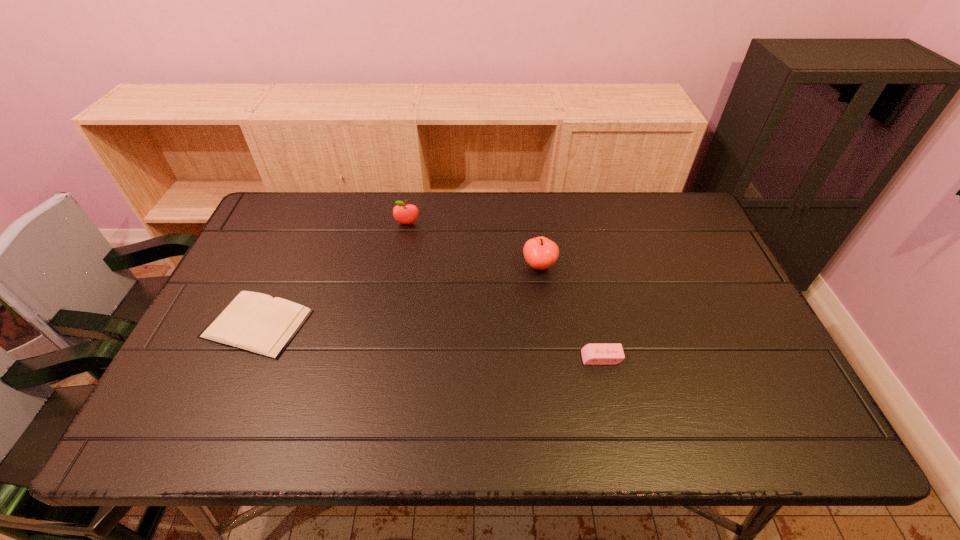
Identify the location of vacant space situated on the back of the third tallest object. This screenshot has width=960, height=540. (591, 315).

Locate an element on the screen. The width and height of the screenshot is (960, 540). vacant region located 0.080m on the front of the shortest object is located at coordinates (228, 390).

The width and height of the screenshot is (960, 540). Find the location of `object at the far edge`. object at the far edge is located at coordinates (403, 213).

I want to click on object at the left edge, so click(x=255, y=322).

The width and height of the screenshot is (960, 540). Identify the location of vacant space at the far edge of the desktop. (493, 238).

The height and width of the screenshot is (540, 960). Find the location of `blank space at the near edge`. blank space at the near edge is located at coordinates (585, 439).

In the image, there is a desktop. Where is `vacant space at the right edge`? vacant space at the right edge is located at coordinates 717,266.

In the image, there is a desktop. At what (x,y) coordinates should I click in order to perform the action: click on free space at the near left corner. Please return your answer as a coordinate pair (x, y). The width and height of the screenshot is (960, 540). Looking at the image, I should click on (197, 408).

The height and width of the screenshot is (540, 960). Identify the location of vacant space at the far right corner of the desktop. (657, 231).

Locate an element on the screen. The height and width of the screenshot is (540, 960). unoccupied position between the eraser and the third nearest object is located at coordinates (570, 312).